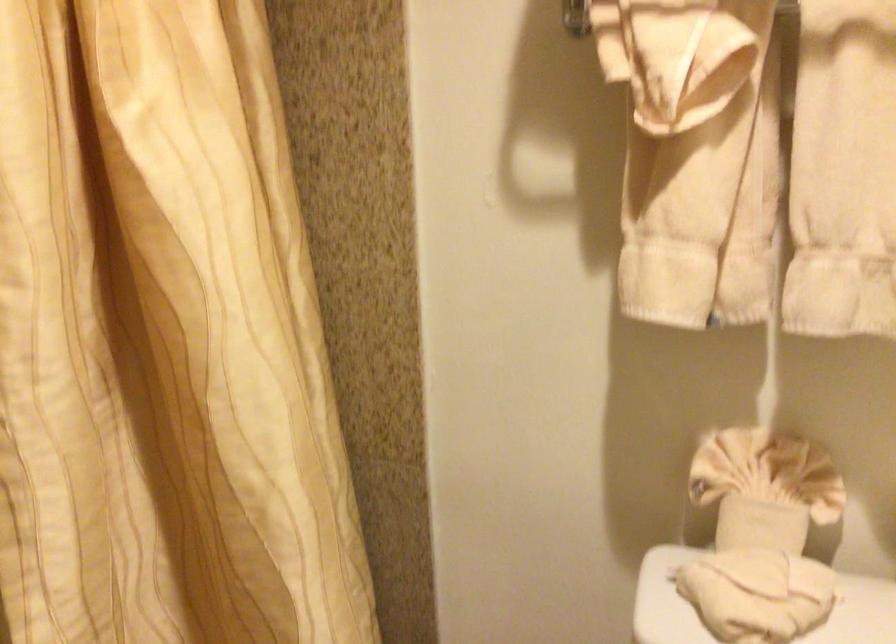
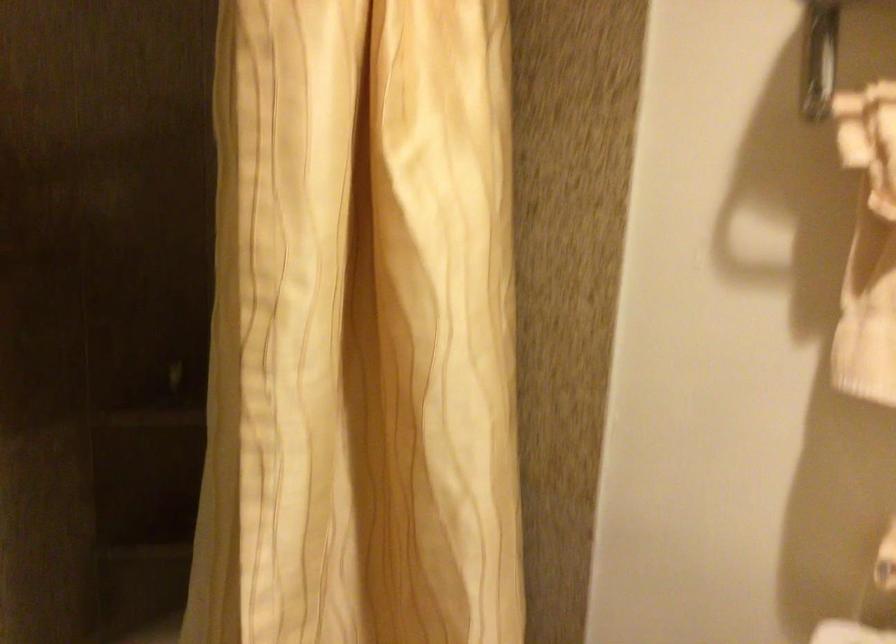
Question: The images are taken continuously from a first-person perspective. In which direction is your viewpoint rotating?

Choices:
 (A) Left
 (B) Right
 (C) Up
 (D) Down

Answer: (A)